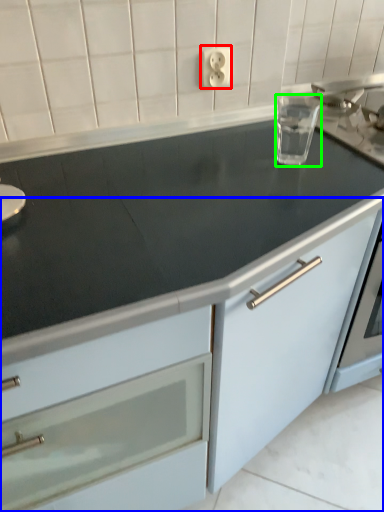
Question: Estimate the real-world distances between objects in this image. Which object is closer to electric outlet (highlighted by a red box), cabinetry (highlighted by a blue box) or appliance (highlighted by a green box)?

Choices:
 (A) cabinetry
 (B) appliance

Answer: (B)